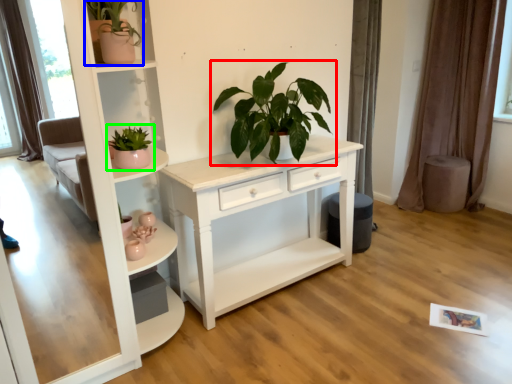
Question: Which is farther away from houseplant (highlighted by a red box)? houseplant (highlighted by a blue box) or houseplant (highlighted by a green box)?

Choices:
 (A) houseplant
 (B) houseplant

Answer: (A)